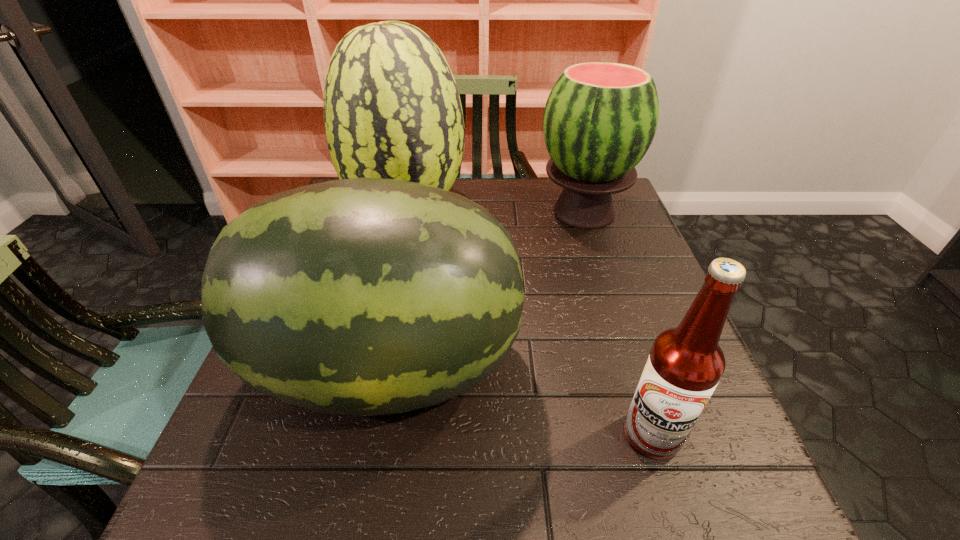
You are a GUI agent. You are given a task and a screenshot of the screen. Output one action in this format:
    pyautogui.click(x=<x>, y=<y>)
    Task: Click on the unoccupied area between the nearest watermelon and the alcohol
    
    Given the screenshot: What is the action you would take?
    click(x=519, y=400)

Locate an element on the screen. This screenshot has height=540, width=960. vacant space in between the rightmost watermelon and the alcohol is located at coordinates (617, 323).

In order to click on free space that is in between the tallest object and the alcohol in this screenshot , I will do `click(529, 322)`.

Find the location of a particular element. Image resolution: width=960 pixels, height=540 pixels. free space between the alcohol and the nearest watermelon is located at coordinates (519, 400).

Locate an element on the screen. blank region between the tallest watermelon and the alcohol is located at coordinates (529, 322).

Where is `free space between the rightmost watermelon and the alcohol`? The height and width of the screenshot is (540, 960). free space between the rightmost watermelon and the alcohol is located at coordinates (617, 323).

Locate which object is the closest to the alcohol. Please provide its 2D coordinates. Your answer should be formatted as a tuple, i.e. [(x, y)], where the tuple contains the x and y coordinates of a point satisfying the conditions above.

[(368, 296)]

Point out which object is positioned as the second nearest to the nearest watermelon. Please provide its 2D coordinates. Your answer should be formatted as a tuple, i.e. [(x, y)], where the tuple contains the x and y coordinates of a point satisfying the conditions above.

[(392, 110)]

Select which watermelon appears as the second closest to the rightmost watermelon. Please provide its 2D coordinates. Your answer should be formatted as a tuple, i.e. [(x, y)], where the tuple contains the x and y coordinates of a point satisfying the conditions above.

[(368, 296)]

Choose which watermelon is the second nearest neighbor to the alcohol. Please provide its 2D coordinates. Your answer should be formatted as a tuple, i.e. [(x, y)], where the tuple contains the x and y coordinates of a point satisfying the conditions above.

[(600, 118)]